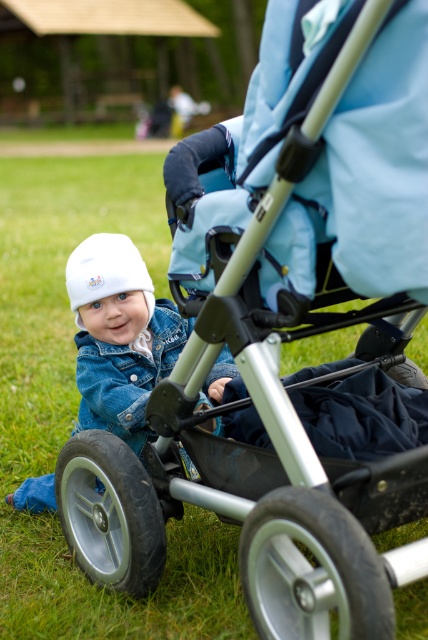
From the picture: Is white matte hat at lower left below white fleece hat at center?

Indeed, white matte hat at lower left is positioned under white fleece hat at center.

Is white matte hat at lower left to the left of white fleece hat at center from the viewer's perspective?

Incorrect, white matte hat at lower left is not on the left side of white fleece hat at center.

Does point (35, 483) lie in front of point (142, 278)?

That is False.

Find the location of a particular element. white matte hat at lower left is located at coordinates (119, 336).